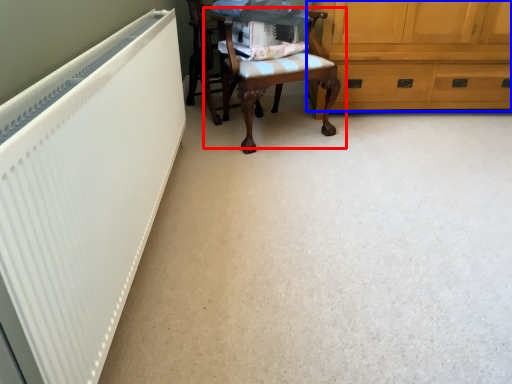
Question: Among these objects, which one is nearest to the camera, chair (highlighted by a red box) or cabinetry (highlighted by a blue box)?

Choices:
 (A) chair
 (B) cabinetry

Answer: (A)